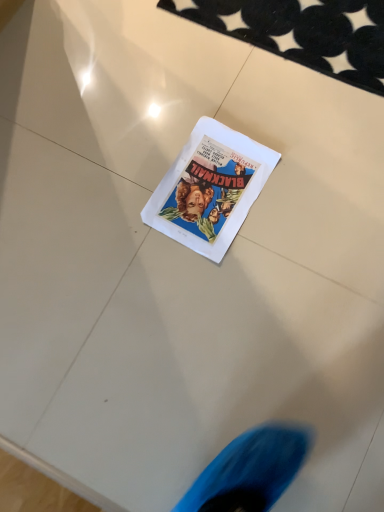
Question: Should I look upward or downward to see white paper flyer at center?

Choices:
 (A) up
 (B) down

Answer: (A)